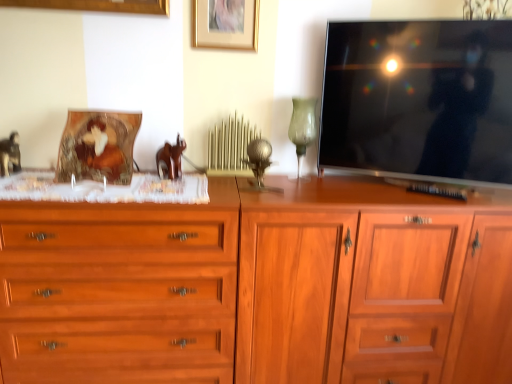
Where is `vacant area that lies between matte black tv at upper right and metallic silver table lamp at center, placed as the second table lamp when sorted from right to left`? This screenshot has height=384, width=512. vacant area that lies between matte black tv at upper right and metallic silver table lamp at center, placed as the second table lamp when sorted from right to left is located at coordinates (346, 190).